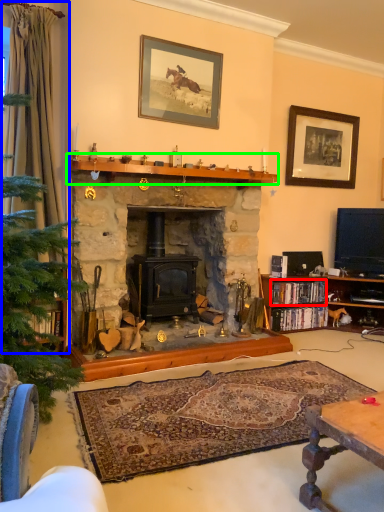
Question: Which is farther away from book (highlighted by a red box)? curtain (highlighted by a blue box) or mantle (highlighted by a green box)?

Choices:
 (A) curtain
 (B) mantle

Answer: (A)